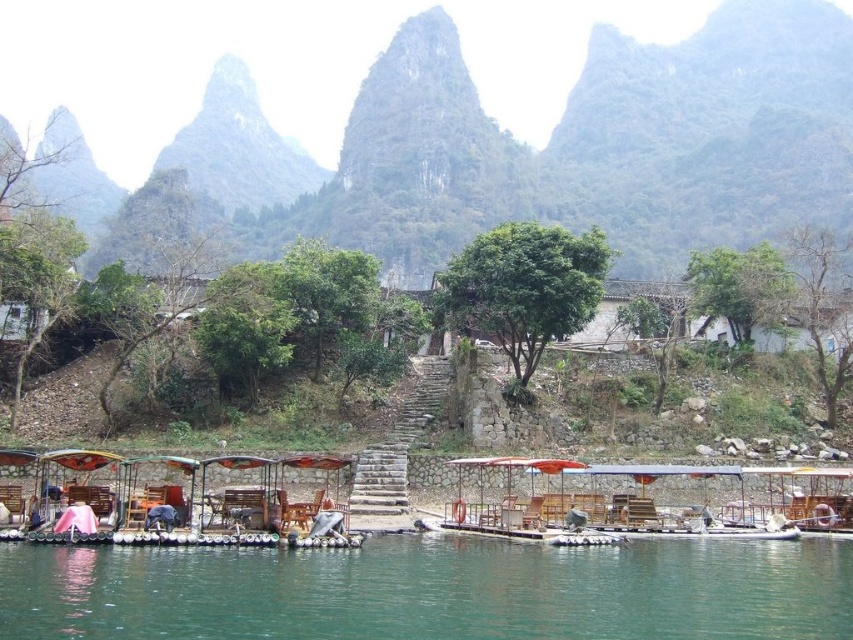
Between green water at lower center and wooden boat at center, which one is positioned higher?

wooden boat at center is above.

Does point (558, 608) come behind point (618, 536)?

No, it is not.

Is point (347, 609) farther from camera compared to point (614, 493)?

No, it is in front of (614, 493).

In order to click on green water at lower center in this screenshot , I will do `click(431, 589)`.

Does point (693, 108) lie in front of point (321, 502)?

No, it is not.

Who is more distant from viewer, [807,76] or [213,522]?

The point [807,76] is behind.

Find the location of a particular element. Image resolution: width=853 pixels, height=640 pixels. green textured mountain at upper center is located at coordinates (595, 145).

The image size is (853, 640). Describe the element at coordinates (595, 145) in the screenshot. I see `green textured mountain at upper center` at that location.

Between green textured mountain at upper center and wooden boat at center, which one is positioned lower?

wooden boat at center is below.

Does point (461, 161) come behind point (740, 467)?

Yes.

The height and width of the screenshot is (640, 853). Identify the location of green textured mountain at upper center. (595, 145).